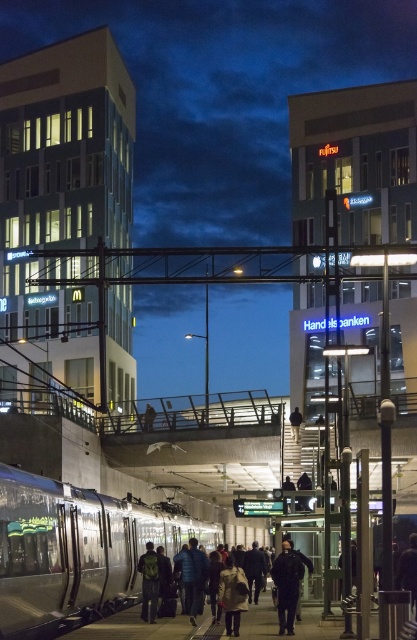
Based on the photo, you are a photographer standing on the train station platform. You want to take a photo of the silver metallic train at lower left and the dark gray jacket at center. Which object should you focus on first if you want both to be in sharp focus?

The silver metallic train at lower left is closer to the viewer than the dark gray jacket at center. To have both in sharp focus, focus on the dark gray jacket at center because it is farther away, ensuring the depth of field includes both.

You are a photographer standing on the train station platform. You want to capture a photo that includes both the silver metallic train at lower left and the dark gray jacket at center. Which object should you focus on first to ensure both are in frame?

The silver metallic train at lower left is taller than the dark gray jacket at center. To ensure both are in frame, focus on the taller object first, which is the silver metallic train at lower left, then adjust the camera angle to include the dark gray jacket at center.

You are a photographer trying to capture a candid shot of the two people on the train station platform. You notice the dark gray jacket at center and the light beige coat at center. Which of these two clothing items would appear wider in your photo?

The dark gray jacket at center would appear wider in the photo since its width surpasses that of the light beige coat at center.